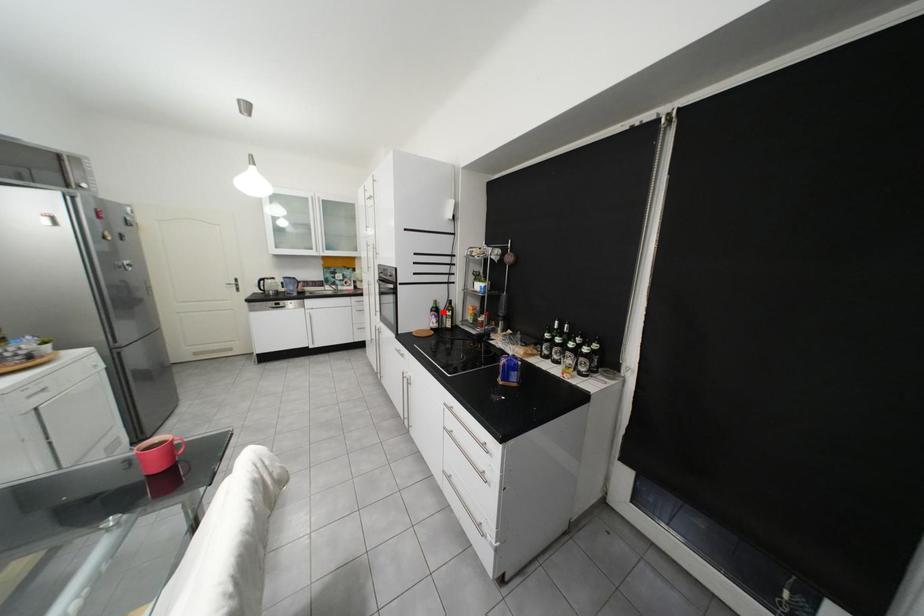
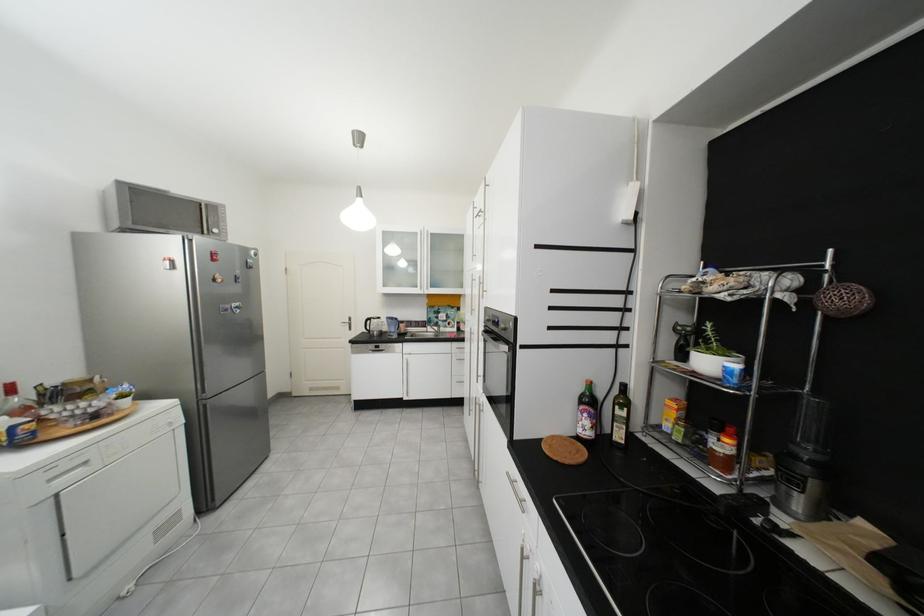
Where in the second image is the point corresponding to the highlighted location from the first image?

(592, 403)